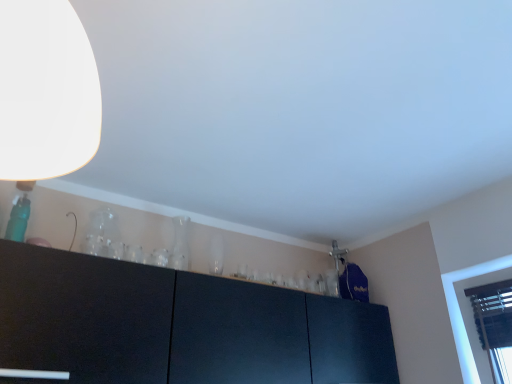
Question: Is point (94, 137) closer or farther from the camera than point (89, 226)?

Choices:
 (A) closer
 (B) farther

Answer: (A)

Question: Choose the correct answer: Is white matte lampshade at upper left inside transparent glass vase at upper center, the 2th glass vase in the back-to-front sequence, or outside it?

Choices:
 (A) outside
 (B) inside

Answer: (A)

Question: Considering the real-world distances, which object is closest to the transparent glass vase at upper center, the 2th glass vase in the back-to-front sequence?

Choices:
 (A) transparent glass vase at center, the second glass vase from the left
 (B) white matte lampshade at upper left

Answer: (A)

Question: Based on their relative distances, which object is farther from the white matte lampshade at upper left?

Choices:
 (A) transparent glass vase at upper center, the 2th glass vase in the back-to-front sequence
 (B) transparent glass vase at center, the 2th glass vase viewed from the front

Answer: (B)